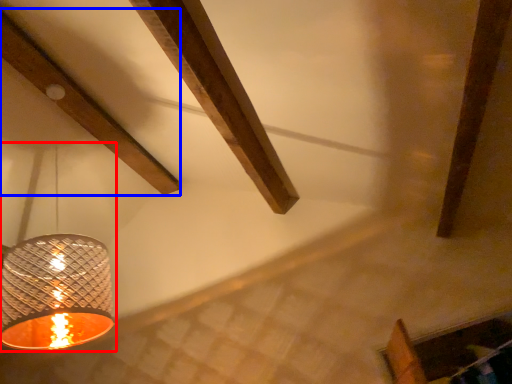
Question: Which object appears closest to the camera in this image, lamp (highlighted by a red box) or plank (highlighted by a blue box)?

Choices:
 (A) lamp
 (B) plank

Answer: (A)